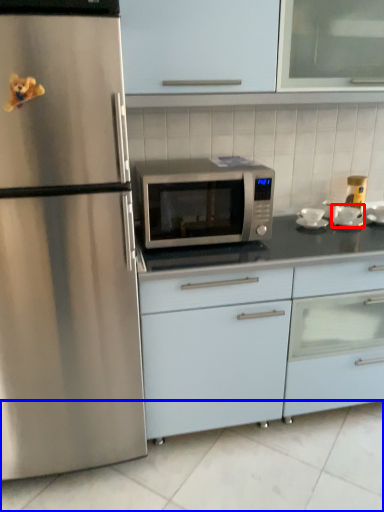
Question: Which of the following is the farthest to the observer, appliance (highlighted by a red box) or tile (highlighted by a blue box)?

Choices:
 (A) appliance
 (B) tile

Answer: (A)